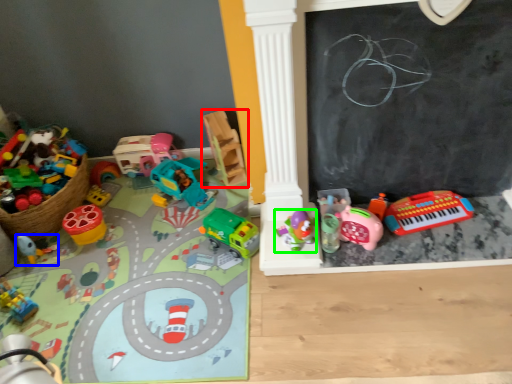
Question: Which is nearer to the toy (highlighted by a red box)? toy (highlighted by a blue box) or toy (highlighted by a green box).

Choices:
 (A) toy
 (B) toy

Answer: (B)